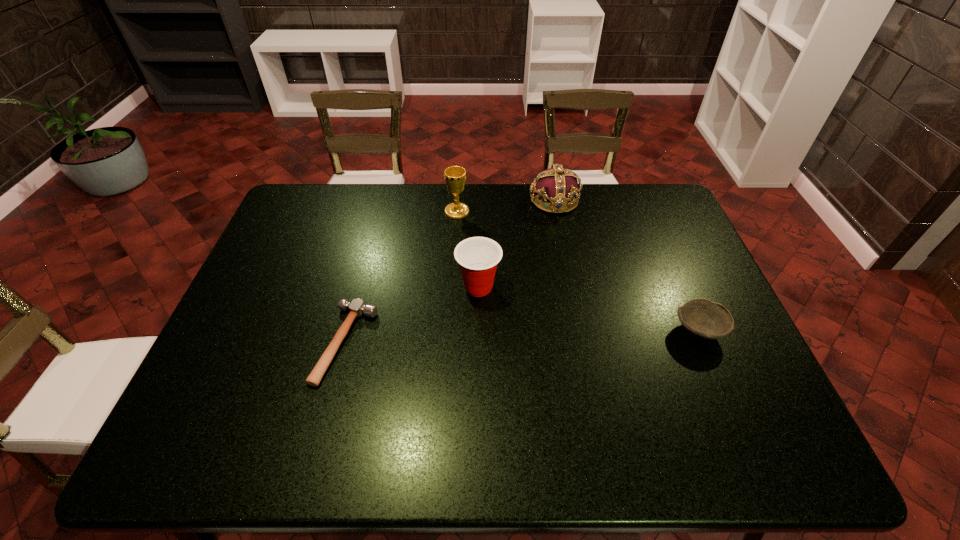
I want to click on vacant space at the near left corner of the desktop, so click(192, 456).

This screenshot has width=960, height=540. I want to click on vacant space that's between the chalice and the crown, so (506, 206).

The height and width of the screenshot is (540, 960). I want to click on free space between the chalice and the bowl, so click(x=578, y=271).

I want to click on free space between the third nearest object and the bowl, so click(588, 309).

At what (x,y) coordinates should I click in order to perform the action: click on unoccupied area between the cup and the second object from right to left. Please return your answer as a coordinate pair (x, y). Looking at the image, I should click on (516, 244).

You are a GUI agent. You are given a task and a screenshot of the screen. Output one action in this format:
    pyautogui.click(x=<x>, y=<y>)
    Task: Click on the vacant point located between the chalice and the fourth tallest object
    Image resolution: width=960 pixels, height=540 pixels.
    Given the screenshot: What is the action you would take?
    pyautogui.click(x=578, y=271)

I want to click on vacant area between the hammer and the third nearest object, so click(x=412, y=315).

Where is `vacant region between the shortest object and the second object from right to left`? vacant region between the shortest object and the second object from right to left is located at coordinates (450, 272).

Image resolution: width=960 pixels, height=540 pixels. I want to click on free space between the chalice and the fourth object from left to right, so click(x=506, y=206).

Choose which object is the second nearest neighbor to the leftmost object. Please provide its 2D coordinates. Your answer should be formatted as a tuple, i.e. [(x, y)], where the tuple contains the x and y coordinates of a point satisfying the conditions above.

[(455, 176)]